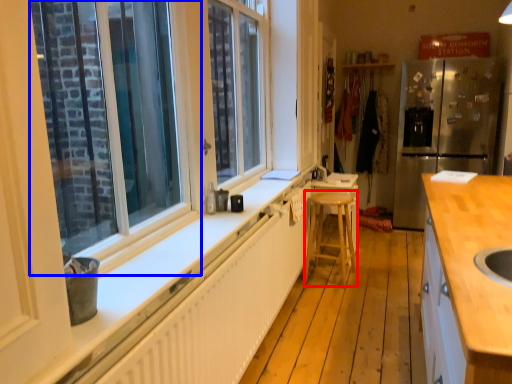
Question: Which object appears farthest to the camera in this image, bar stool (highlighted by a red box) or window (highlighted by a blue box)?

Choices:
 (A) bar stool
 (B) window

Answer: (A)